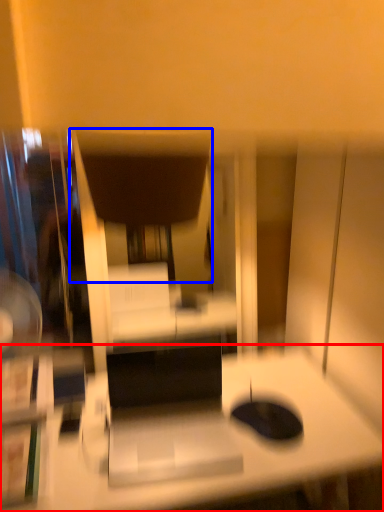
Question: Among these objects, which one is farthest to the camera, desk (highlighted by a red box) or swivel chair (highlighted by a blue box)?

Choices:
 (A) desk
 (B) swivel chair

Answer: (B)